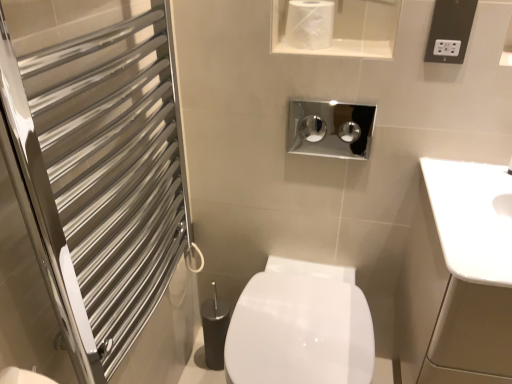
Question: Is white glossy toilet paper at upper center to the left or to the right of white glossy bidet at center in the image?

Choices:
 (A) right
 (B) left

Answer: (A)

Question: In terms of width, does white glossy toilet paper at upper center look wider or thinner when compared to white glossy bidet at center?

Choices:
 (A) thin
 (B) wide

Answer: (A)

Question: Estimate the real-world distances between objects in this image. Which object is farther from the black plastic electrical outlet at upper right?

Choices:
 (A) silver metallic towel rack at left
 (B) white glossy bidet at center
 (C) white glossy toilet paper at upper center

Answer: (A)

Question: Which object is positioned closest to the white glossy bidet at center?

Choices:
 (A) silver metallic towel rack at left
 (B) black plastic electrical outlet at upper right
 (C) white glossy toilet paper at upper center

Answer: (A)